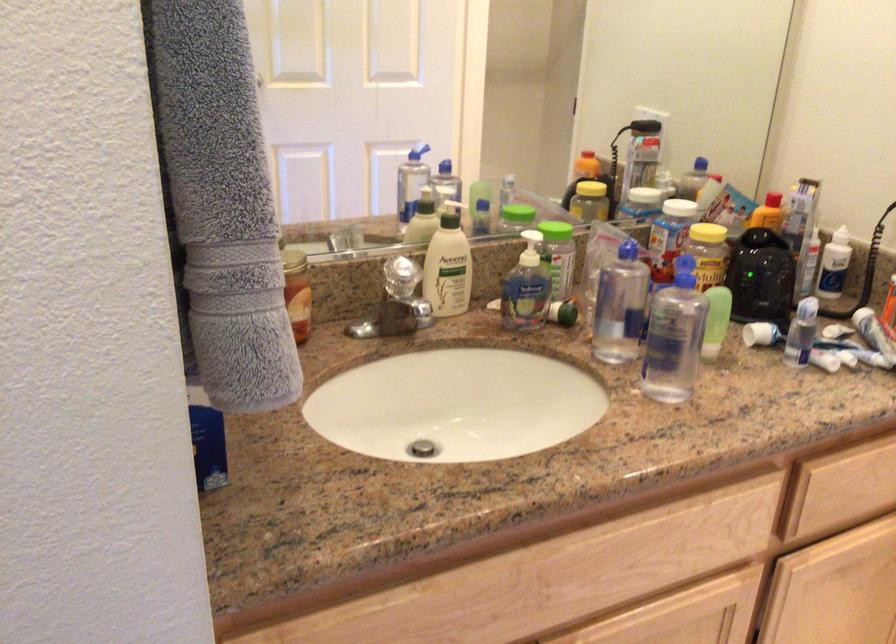
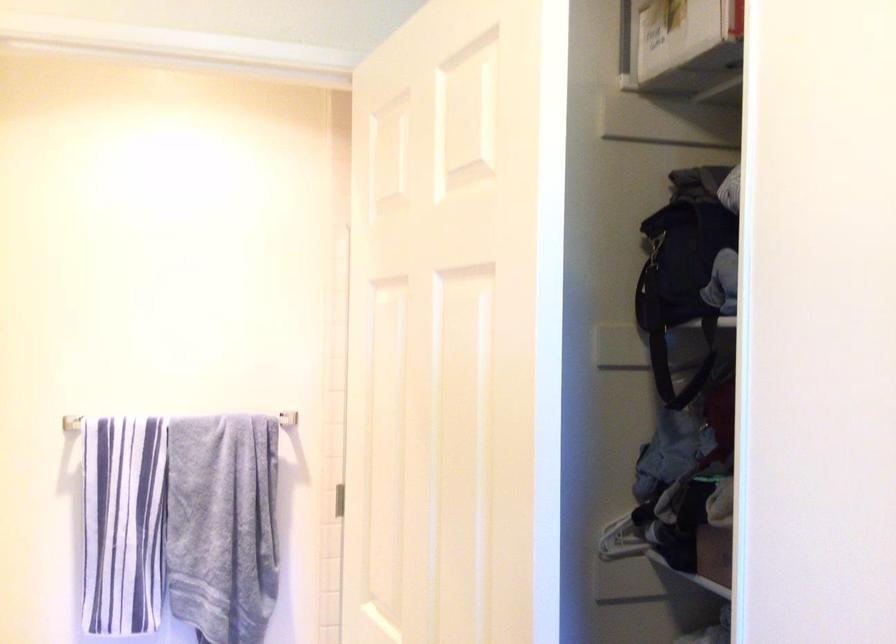
Question: Based on the continuous images, in which direction is the camera rotating? Reply with the corresponding letter.

Choices:
 (A) Left
 (B) Right
 (C) Up
 (D) Down

Answer: (B)